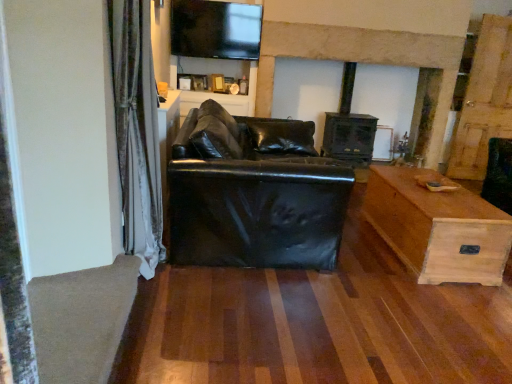
Question: Is dark wood fireplace at center a part of velvet curtain at left?

Choices:
 (A) yes
 (B) no

Answer: (B)

Question: Considering the relative positions of velvet curtain at left and dark wood fireplace at center in the image provided, is velvet curtain at left to the right of dark wood fireplace at center from the viewer's perspective?

Choices:
 (A) yes
 (B) no

Answer: (B)

Question: Is velvet curtain at left oriented towards dark wood fireplace at center?

Choices:
 (A) no
 (B) yes

Answer: (A)

Question: From a real-world perspective, does velvet curtain at left sit lower than dark wood fireplace at center?

Choices:
 (A) no
 (B) yes

Answer: (B)

Question: Does velvet curtain at left have a smaller size compared to dark wood fireplace at center?

Choices:
 (A) yes
 (B) no

Answer: (A)

Question: Is velvet curtain at left not near dark wood fireplace at center?

Choices:
 (A) yes
 (B) no

Answer: (A)

Question: Is wooden chest at right not close to velvet curtain at left?

Choices:
 (A) yes
 (B) no

Answer: (A)

Question: Is wooden chest at right turned away from velvet curtain at left?

Choices:
 (A) no
 (B) yes

Answer: (A)

Question: Is wooden chest at right positioned before velvet curtain at left?

Choices:
 (A) yes
 (B) no

Answer: (B)

Question: Is wooden chest at right aimed at velvet curtain at left?

Choices:
 (A) no
 (B) yes

Answer: (B)

Question: Does wooden chest at right have a greater width compared to velvet curtain at left?

Choices:
 (A) no
 (B) yes

Answer: (B)

Question: Is wooden chest at right touching velvet curtain at left?

Choices:
 (A) yes
 (B) no

Answer: (B)

Question: Is matte black entertainment center at upper center in front of wooden chest at right?

Choices:
 (A) yes
 (B) no

Answer: (B)